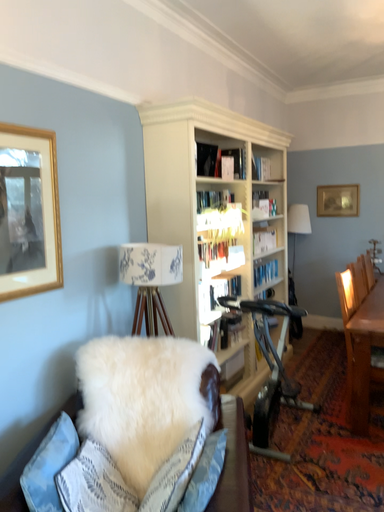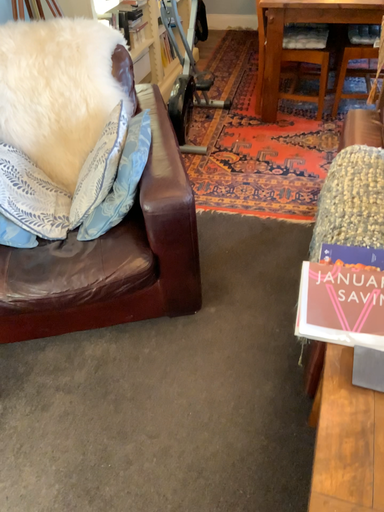
Question: How did the camera likely rotate when shooting the video?

Choices:
 (A) rotated right
 (B) rotated left

Answer: (A)